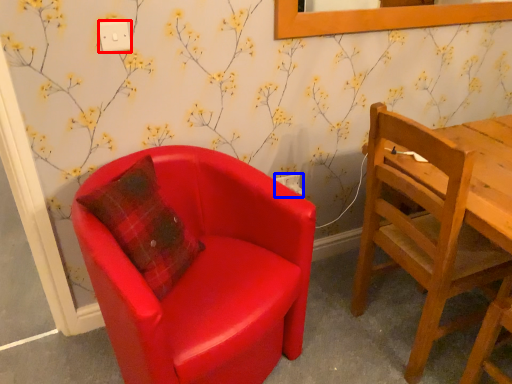
Question: Among these objects, which one is nearest to the camera, power outlet (highlighted by a red box) or power outlet (highlighted by a blue box)?

Choices:
 (A) power outlet
 (B) power outlet

Answer: (A)